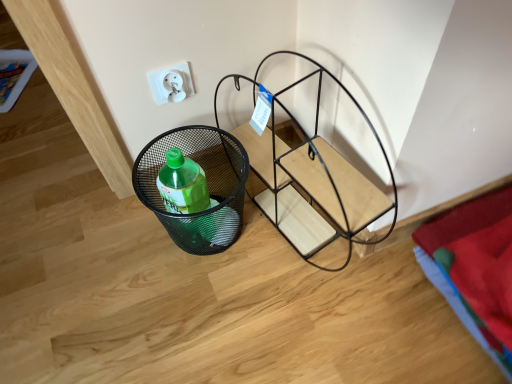
Question: Considering the positions of point (287, 226) and point (159, 89), is point (287, 226) closer or farther from the camera than point (159, 89)?

Choices:
 (A) closer
 (B) farther

Answer: (B)

Question: Looking at the image, does black metal wire basket at lower left seem bigger or smaller compared to white plastic electric outlet at upper center?

Choices:
 (A) big
 (B) small

Answer: (A)

Question: Which object is positioned farthest from the black metal wire basket at lower left?

Choices:
 (A) white plastic electric outlet at upper center
 (B) black mesh basket at lower left

Answer: (A)

Question: Estimate the real-world distances between objects in this image. Which object is farther from the white plastic electric outlet at upper center?

Choices:
 (A) black metal wire basket at lower left
 (B) black mesh basket at lower left

Answer: (A)